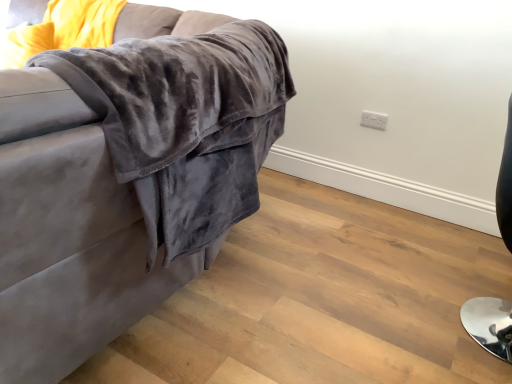
Where is `free location to the left of shiny black chair at right`? The image size is (512, 384). free location to the left of shiny black chair at right is located at coordinates point(389,304).